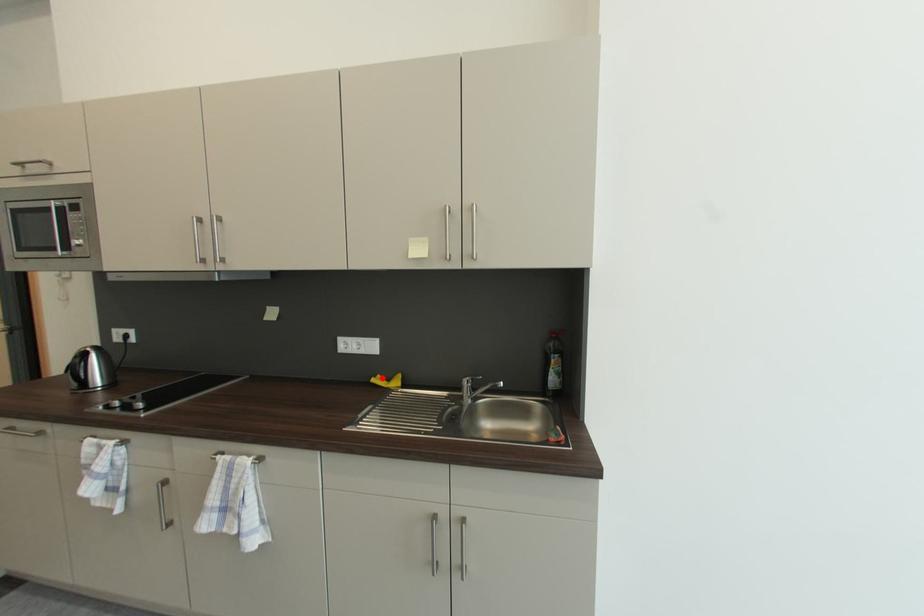
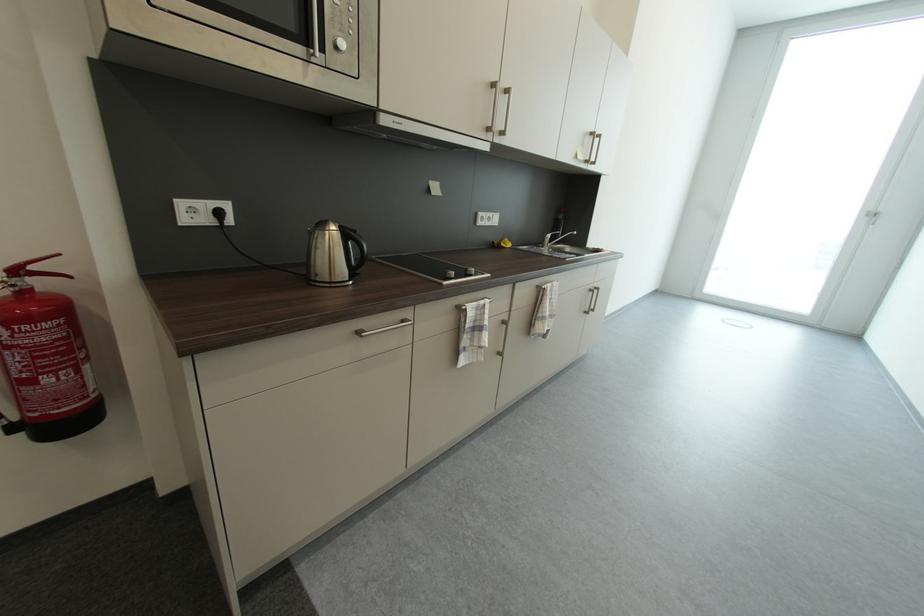
Where in the second image is the point corresponding to the highlighted location from the first image?

(501, 244)